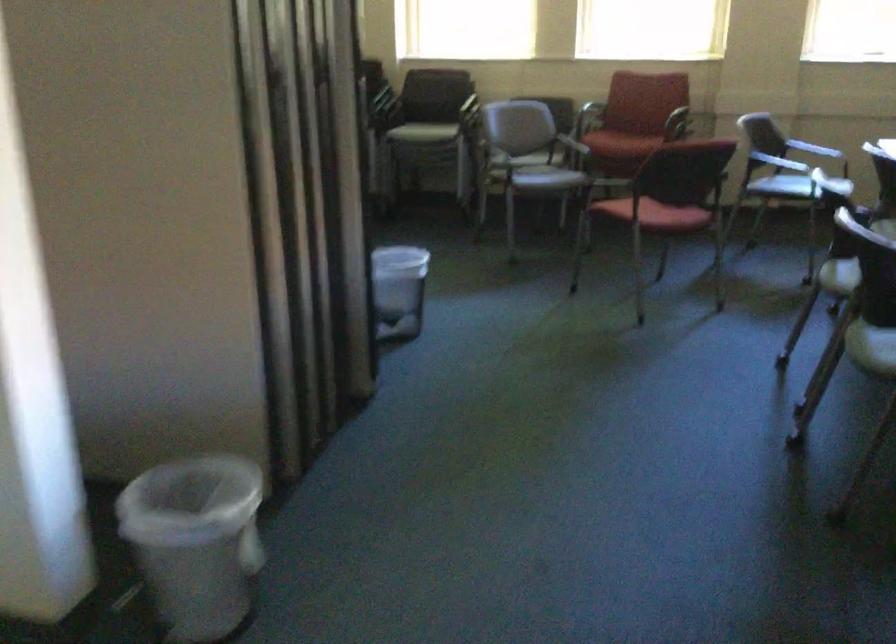
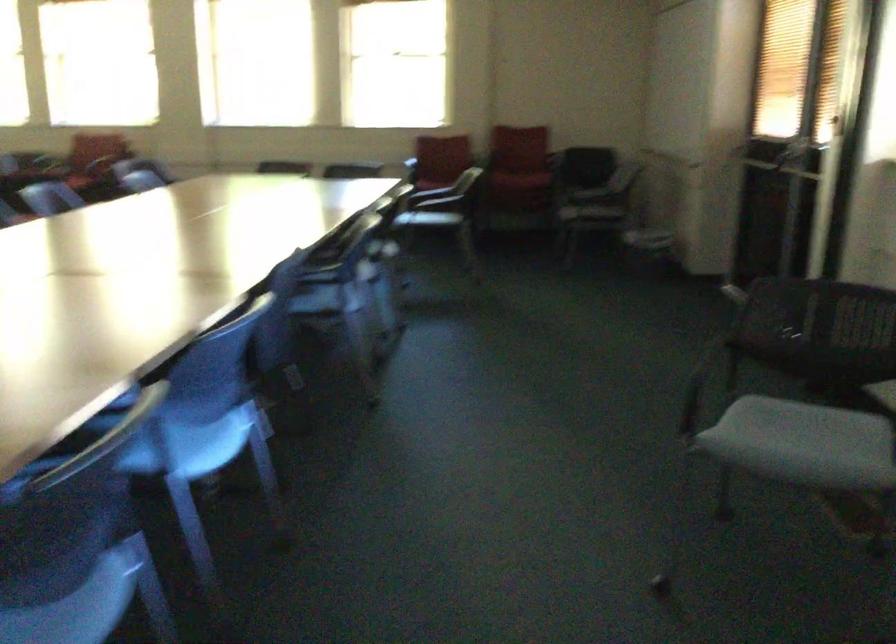
Which direction would the cameraman need to move to produce the second image?

The cameraman moved toward right, backward.